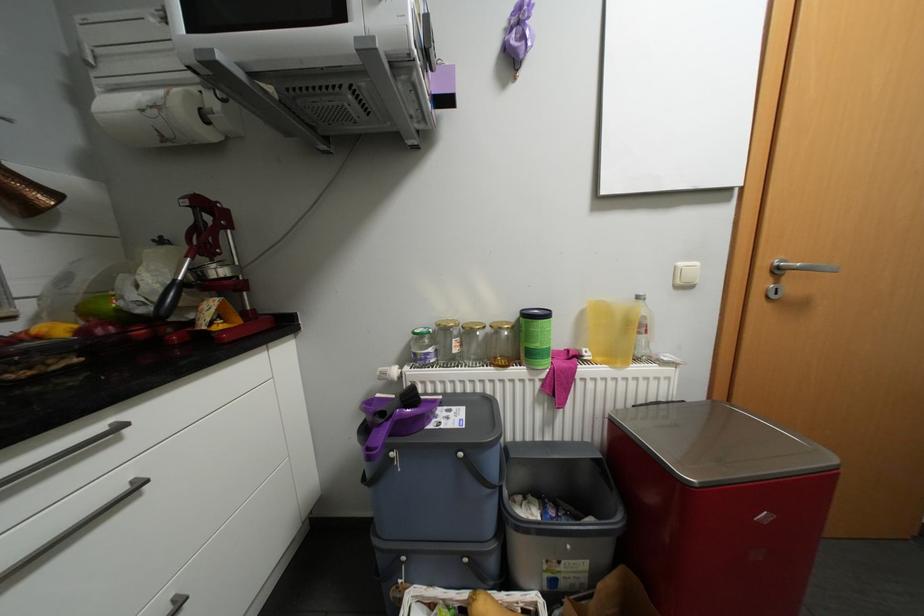
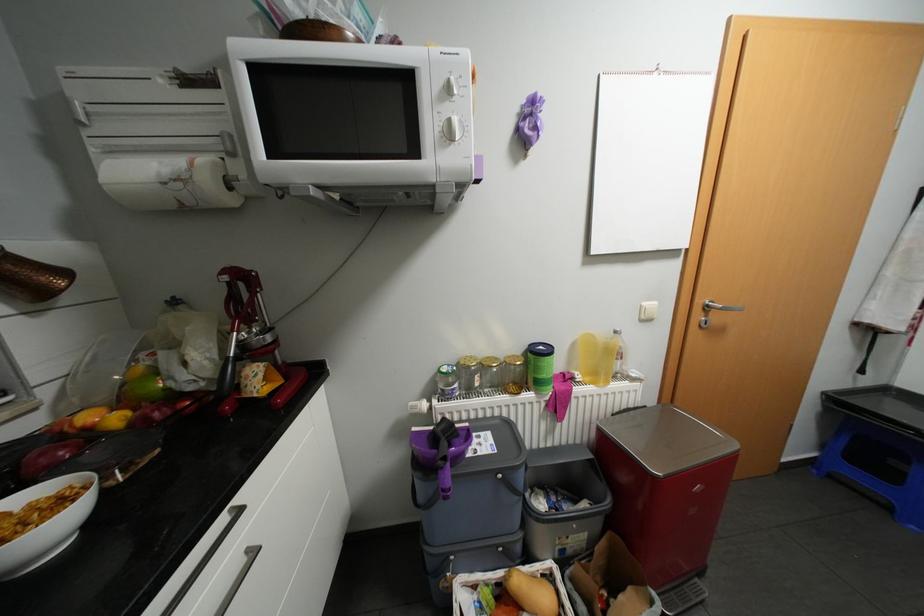
Find the pixel in the second image that matches the point at 386,424 in the first image.

(450, 467)